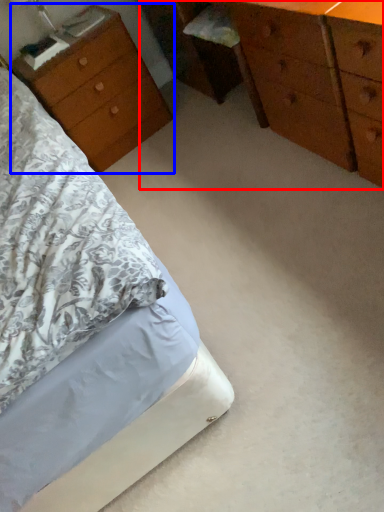
Question: Which point is closer to the camera, chest of drawers (highlighted by a red box) or nightstand (highlighted by a blue box)?

Choices:
 (A) chest of drawers
 (B) nightstand

Answer: (A)